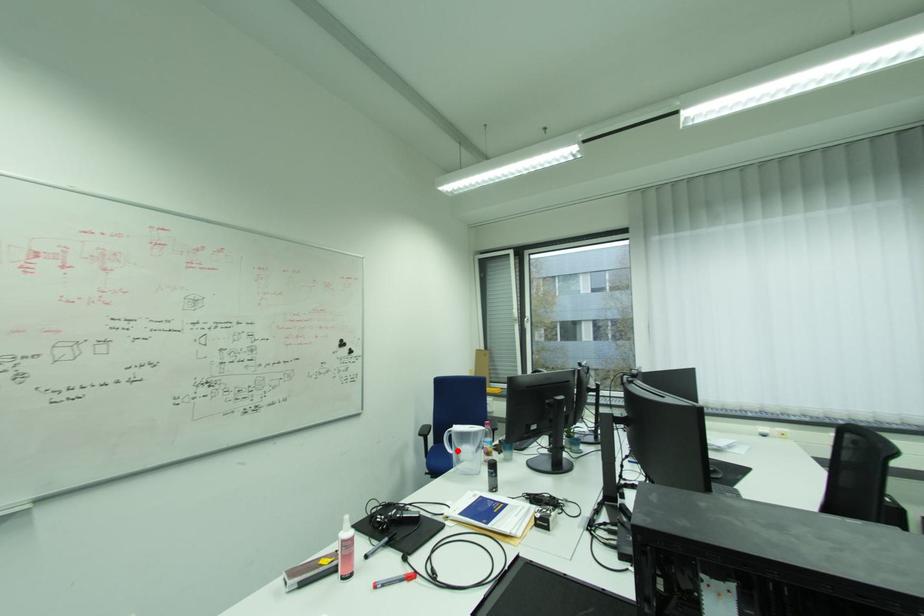
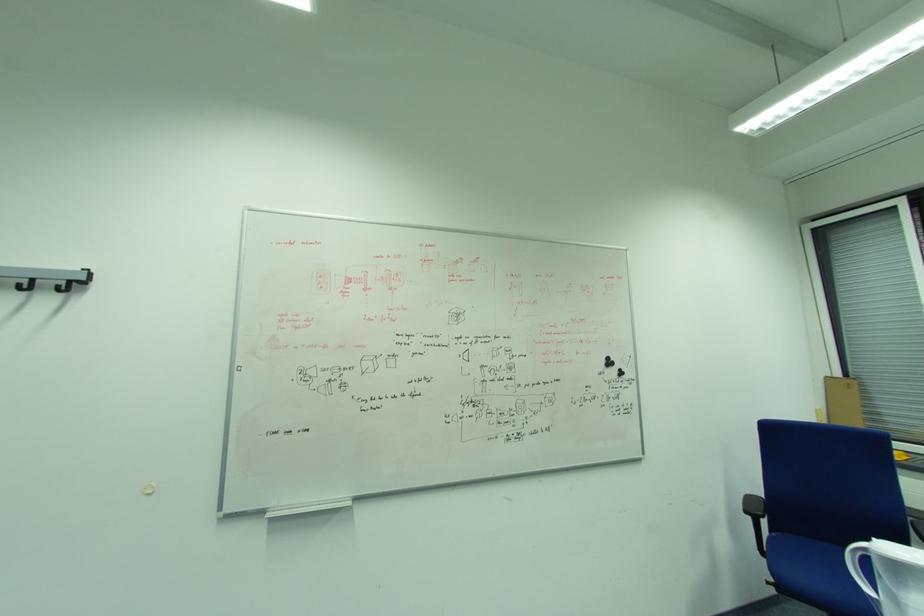
Where in the second image is the point corresponding to the highlighted location from the first image?

(876, 591)